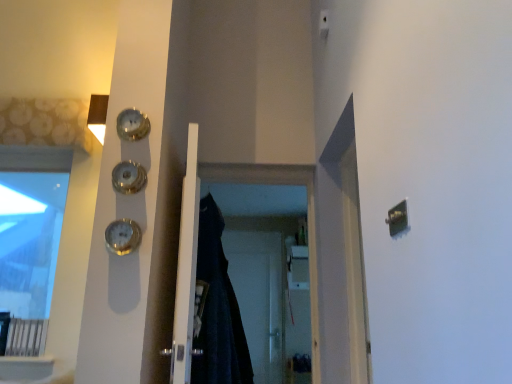
Question: Does shiny gold clock at upper left, the second clock when ordered from top to bottom, touch black fabric screen door at center, arranged as the 1th screen door when viewed from the front?

Choices:
 (A) no
 (B) yes

Answer: (A)

Question: From a real-world perspective, is shiny gold clock at upper left, the second clock when ordered from top to bottom, positioned over black fabric screen door at center, arranged as the 1th screen door when viewed from the front, based on gravity?

Choices:
 (A) no
 (B) yes

Answer: (B)

Question: Is shiny gold clock at upper left, which is the 2th clock in bottom-to-top order, facing towards black fabric screen door at center, arranged as the 1th screen door when viewed from the front?

Choices:
 (A) yes
 (B) no

Answer: (B)

Question: Is shiny gold clock at upper left, the second clock when ordered from top to bottom, not near black fabric screen door at center, arranged as the 1th screen door when viewed from the front?

Choices:
 (A) no
 (B) yes

Answer: (B)

Question: Can you confirm if shiny gold clock at upper left, which is the 2th clock in bottom-to-top order, is wider than black fabric screen door at center, arranged as the 1th screen door when viewed from the front?

Choices:
 (A) yes
 (B) no

Answer: (B)

Question: Looking at their shapes, would you say transparent glass window at upper left is wider or thinner than white plastic light switch at upper center?

Choices:
 (A) wide
 (B) thin

Answer: (A)

Question: Relative to white plastic light switch at upper center, is transparent glass window at upper left in front or behind?

Choices:
 (A) front
 (B) behind

Answer: (A)

Question: From a real-world perspective, is transparent glass window at upper left positioned above or below white plastic light switch at upper center?

Choices:
 (A) below
 (B) above

Answer: (A)

Question: Which is correct: transparent glass window at upper left is inside white plastic light switch at upper center, or outside of it?

Choices:
 (A) outside
 (B) inside

Answer: (A)

Question: Is transparent plastic screen door at center, placed as the 1th screen door when sorted from back to front, situated inside white plastic light switch at upper center or outside?

Choices:
 (A) inside
 (B) outside

Answer: (B)

Question: From the image's perspective, relative to white plastic light switch at upper center, is transparent plastic screen door at center, which is counted as the second screen door, starting from the front, above or below?

Choices:
 (A) above
 (B) below

Answer: (B)

Question: Visually, is transparent plastic screen door at center, which is counted as the second screen door, starting from the front, positioned to the left or to the right of white plastic light switch at upper center?

Choices:
 (A) left
 (B) right

Answer: (A)

Question: From a real-world perspective, relative to white plastic light switch at upper center, is transparent plastic screen door at center, placed as the 1th screen door when sorted from back to front, vertically above or below?

Choices:
 (A) below
 (B) above

Answer: (A)

Question: Is point (181, 291) closer or farther from the camera than point (133, 248)?

Choices:
 (A) farther
 (B) closer

Answer: (A)

Question: In the image, is white matte door at center positioned in front of or behind gold metallic clock at left, which ranks as the 3th clock in top-to-bottom order?

Choices:
 (A) behind
 (B) front

Answer: (B)